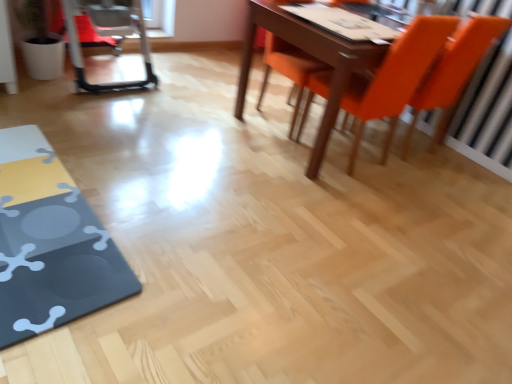
What do you see at coordinates (288, 68) in the screenshot? I see `orange matte chair at upper right, the 1th chair when ordered from left to right` at bounding box center [288, 68].

At what (x,y) coordinates should I click in order to perform the action: click on orange matte chair at upper right, the 1th chair when ordered from left to right. Please return your answer as a coordinate pair (x, y). The image size is (512, 384). Looking at the image, I should click on (288, 68).

What is the approximate width of orange matte chair at upper right, acting as the second chair starting from the left?

orange matte chair at upper right, acting as the second chair starting from the left, is 24.20 inches wide.

Image resolution: width=512 pixels, height=384 pixels. I want to click on matte black table at lower left, so click(x=50, y=243).

Considering the points (443, 60) and (41, 294), which point is behind, point (443, 60) or point (41, 294)?

The point (443, 60) is behind.

How much distance is there between orange matte chair at right, the first chair in the right-to-left sequence, and matte black table at lower left?

orange matte chair at right, the first chair in the right-to-left sequence, is 2.15 meters from matte black table at lower left.

Considering the sizes of objects orange matte chair at right, which is the third chair from left to right, and matte black table at lower left in the image provided, who is smaller, orange matte chair at right, which is the third chair from left to right, or matte black table at lower left?

matte black table at lower left is smaller.

From the image's perspective, is orange matte chair at right, the first chair in the right-to-left sequence, below matte black table at lower left?

No, from the image's perspective, orange matte chair at right, the first chair in the right-to-left sequence, is not beneath matte black table at lower left.

Do you think orange matte chair at upper right, the 2th chair positioned from the right, is within metallic silver swivel chair at left, or outside of it?

orange matte chair at upper right, the 2th chair positioned from the right, is located beyond the bounds of metallic silver swivel chair at left.

Between orange matte chair at upper right, the 2th chair positioned from the right, and metallic silver swivel chair at left, which one has smaller size?

orange matte chair at upper right, the 2th chair positioned from the right.

Considering the positions of points (307, 102) and (117, 10), is point (307, 102) closer to camera compared to point (117, 10)?

That is True.

Is orange matte chair at right, the first chair in the right-to-left sequence, not near metallic silver swivel chair at left?

Yes, orange matte chair at right, the first chair in the right-to-left sequence, is far from metallic silver swivel chair at left.

From a real-world perspective, count 3rd chairs upward from the metallic silver swivel chair at left and point to it. Please provide its 2D coordinates.

[(453, 72)]

How different are the orientations of orange matte chair at right, the first chair in the right-to-left sequence, and metallic silver swivel chair at left in degrees?

The angular difference between orange matte chair at right, the first chair in the right-to-left sequence, and metallic silver swivel chair at left is 180 degrees.

How much distance is there between orange matte chair at right, the first chair in the right-to-left sequence, and metallic silver swivel chair at left?

A distance of 2.07 meters exists between orange matte chair at right, the first chair in the right-to-left sequence, and metallic silver swivel chair at left.

Which object is positioned more to the right, orange matte chair at upper right, the 1th chair when ordered from left to right, or matte black table at lower left?

Positioned to the right is orange matte chair at upper right, the 1th chair when ordered from left to right.

Which is in front, point (294, 119) or point (119, 257)?

The point (119, 257) is in front.

Is orange matte chair at upper right, which appears as the third chair when viewed from the right, in front of or behind matte black table at lower left in the image?

In the image, orange matte chair at upper right, which appears as the third chair when viewed from the right, appears behind matte black table at lower left.

From the image's perspective, is orange matte chair at upper right, which appears as the third chair when viewed from the right, located above matte black table at lower left?

Indeed, from the image's perspective, orange matte chair at upper right, which appears as the third chair when viewed from the right, is shown above matte black table at lower left.

From the image's perspective, who appears lower, orange matte chair at upper right, the 2th chair positioned from the right, or orange matte chair at upper right, which appears as the third chair when viewed from the right?

orange matte chair at upper right, the 2th chair positioned from the right.

How different are the orientations of orange matte chair at upper right, acting as the second chair starting from the left, and orange matte chair at upper right, which appears as the third chair when viewed from the right, in degrees?

180 degrees separate the facing orientations of orange matte chair at upper right, acting as the second chair starting from the left, and orange matte chair at upper right, which appears as the third chair when viewed from the right.

From a real-world perspective, is orange matte chair at upper right, acting as the second chair starting from the left, positioned above or below orange matte chair at upper right, which appears as the third chair when viewed from the right?

In terms of real-world spatial position, orange matte chair at upper right, acting as the second chair starting from the left, is above orange matte chair at upper right, which appears as the third chair when viewed from the right.

Is the surface of orange matte chair at upper right, acting as the second chair starting from the left, in direct contact with orange matte chair at upper right, which appears as the third chair when viewed from the right?

orange matte chair at upper right, acting as the second chair starting from the left, and orange matte chair at upper right, which appears as the third chair when viewed from the right, are clearly separated.

How different are the orientations of matte black table at lower left and orange matte chair at upper right, the 2th chair positioned from the right, in degrees?

matte black table at lower left and orange matte chair at upper right, the 2th chair positioned from the right, are facing 88.2 degrees away from each other.

Does matte black table at lower left have a greater width compared to orange matte chair at upper right, the 2th chair positioned from the right?

In fact, matte black table at lower left might be narrower than orange matte chair at upper right, the 2th chair positioned from the right.

Considering the positions of objects matte black table at lower left and orange matte chair at upper right, acting as the second chair starting from the left, in the image provided, who is more to the left, matte black table at lower left or orange matte chair at upper right, acting as the second chair starting from the left,?

matte black table at lower left.

Considering the relative sizes of orange matte chair at right, the first chair in the right-to-left sequence, and orange matte chair at upper right, the 1th chair when ordered from left to right, in the image provided, is orange matte chair at right, the first chair in the right-to-left sequence, smaller than orange matte chair at upper right, the 1th chair when ordered from left to right,?

No, orange matte chair at right, the first chair in the right-to-left sequence, is not smaller than orange matte chair at upper right, the 1th chair when ordered from left to right.

Is point (426, 109) less distant than point (321, 67)?

Yes, point (426, 109) is closer to viewer.

Between orange matte chair at right, which is the third chair from left to right, and orange matte chair at upper right, the 1th chair when ordered from left to right, which one is positioned in front?

Positioned in front is orange matte chair at right, which is the third chair from left to right.

From the image's perspective, count 2nd chairs upward from the matte black table at lower left and point to it. Please provide its 2D coordinates.

[(453, 72)]

From the image's perspective, starting from the metallic silver swivel chair at left, which chair is the 3rd one below? Please provide its 2D coordinates.

[(395, 78)]

Consider the image. Which object lies nearer to the anchor point orange matte chair at right, which is the third chair from left to right, orange matte chair at upper right, which appears as the third chair when viewed from the right, or orange matte chair at upper right, acting as the second chair starting from the left?

The object closer to orange matte chair at right, which is the third chair from left to right, is orange matte chair at upper right, acting as the second chair starting from the left.

Estimate the real-world distances between objects in this image. Which object is closer to orange matte chair at upper right, the 1th chair when ordered from left to right, matte black table at lower left or orange matte chair at upper right, acting as the second chair starting from the left?

orange matte chair at upper right, acting as the second chair starting from the left, is closer to orange matte chair at upper right, the 1th chair when ordered from left to right.

Looking at the image, which one is located closer to orange matte chair at right, the first chair in the right-to-left sequence, orange matte chair at upper right, which appears as the third chair when viewed from the right, or matte black table at lower left?

orange matte chair at upper right, which appears as the third chair when viewed from the right, lies closer to orange matte chair at right, the first chair in the right-to-left sequence, than the other object.

When comparing their distances from matte black table at lower left, does metallic silver swivel chair at left or orange matte chair at upper right, which appears as the third chair when viewed from the right, seem further?

Based on the image, orange matte chair at upper right, which appears as the third chair when viewed from the right, appears to be further to matte black table at lower left.

Consider the image. From the image, which object appears to be farther from orange matte chair at right, which is the third chair from left to right, orange matte chair at upper right, the 2th chair positioned from the right, or metallic silver swivel chair at left?

metallic silver swivel chair at left is positioned further to the anchor orange matte chair at right, which is the third chair from left to right.

From the image, which object appears to be nearer to matte black table at lower left, orange matte chair at upper right, the 2th chair positioned from the right, or orange matte chair at upper right, which appears as the third chair when viewed from the right?

orange matte chair at upper right, the 2th chair positioned from the right, is closer to matte black table at lower left.

From the image, which object appears to be farther from orange matte chair at upper right, the 1th chair when ordered from left to right, orange matte chair at right, which is the third chair from left to right, or metallic silver swivel chair at left?

Among the two, metallic silver swivel chair at left is located further to orange matte chair at upper right, the 1th chair when ordered from left to right.

Which object lies further to the anchor point orange matte chair at right, which is the third chair from left to right, orange matte chair at upper right, which appears as the third chair when viewed from the right, or metallic silver swivel chair at left?

metallic silver swivel chair at left is further to orange matte chair at right, which is the third chair from left to right.

This screenshot has height=384, width=512. Identify the location of table between metallic silver swivel chair at left and orange matte chair at right, which is the third chair from left to right, from left to right. (50, 243).

At what (x,y) coordinates should I click in order to perform the action: click on table between metallic silver swivel chair at left and orange matte chair at upper right, acting as the second chair starting from the left, in the horizontal direction. Please return your answer as a coordinate pair (x, y). Looking at the image, I should click on (50, 243).

The image size is (512, 384). In order to click on chair between orange matte chair at upper right, which appears as the third chair when viewed from the right, and orange matte chair at right, which is the third chair from left to right, from left to right in this screenshot , I will do `click(395, 78)`.

Locate an element on the screen. chair situated between matte black table at lower left and orange matte chair at upper right, acting as the second chair starting from the left, from left to right is located at coordinates (288, 68).